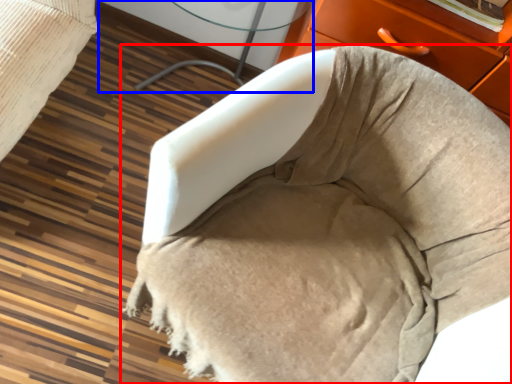
Question: Which object appears farthest to the camera in this image, furniture (highlighted by a red box) or table (highlighted by a blue box)?

Choices:
 (A) furniture
 (B) table

Answer: (B)